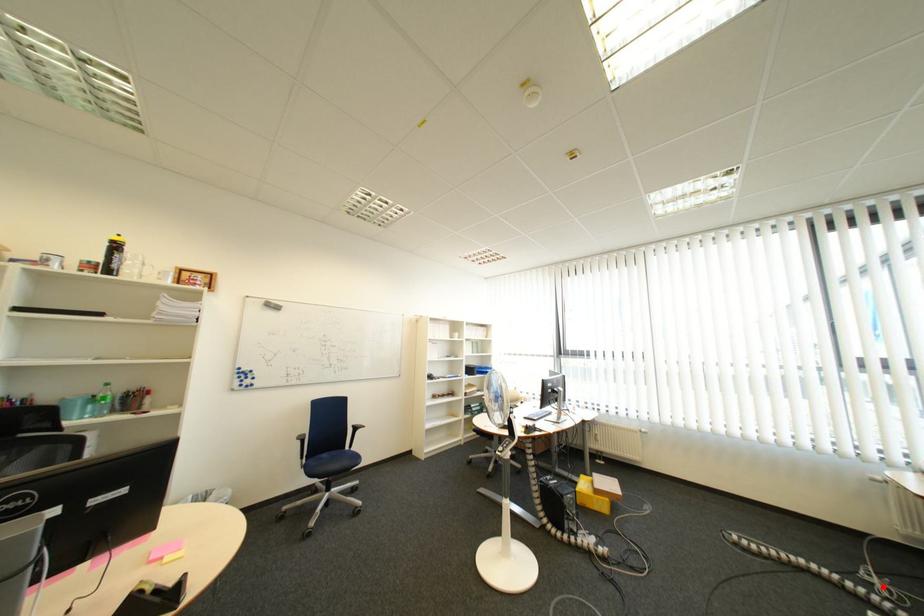
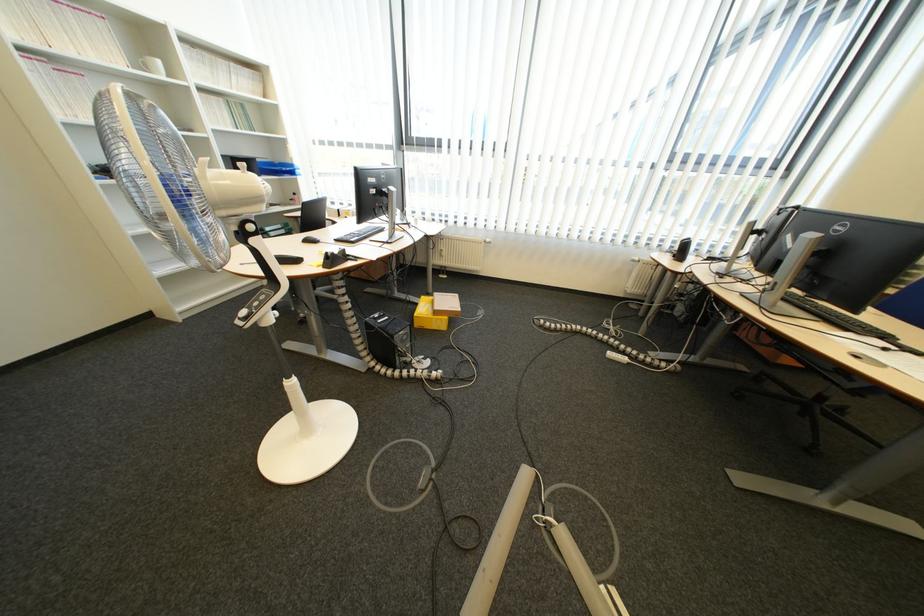
Question: A red point is marked in image1. In image2, is the corresponding 3D point closer to the camera or farther? Reply with the corresponding letter.

Choices:
 (A) The corresponding 3D point is closer.
 (B) The corresponding 3D point is farther.

Answer: (B)